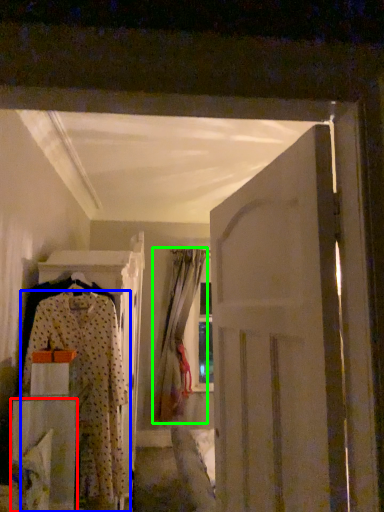
Question: Which object is positioned closest to furniture (highlighted by a red box)? Select from fancy dress (highlighted by a blue box) and curtain (highlighted by a green box).

Choices:
 (A) fancy dress
 (B) curtain

Answer: (A)